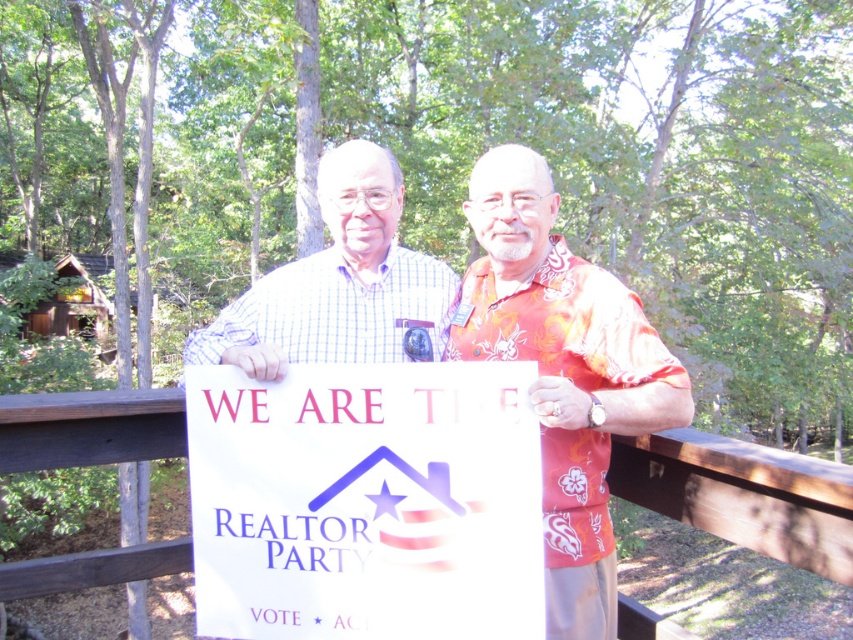
Question: Among these objects, which one is nearest to the camera?

Choices:
 (A) white paper sign at center
 (B) wooden rail at center
 (C) matte white sign at center
 (D) checkered fabric shirt at center

Answer: (B)

Question: Can you confirm if floral print shirt at center is wider than wooden rail at center?

Choices:
 (A) no
 (B) yes

Answer: (B)

Question: Is matte white sign at center positioned behind floral print shirt at center?

Choices:
 (A) yes
 (B) no

Answer: (A)

Question: Among these points, which one is farthest from the camera?

Choices:
 (A) (537, 486)
 (B) (514, 278)
 (C) (329, 358)
 (D) (705, 499)

Answer: (C)

Question: Considering the relative positions of white paper sign at center and checkered fabric shirt at center in the image provided, where is white paper sign at center located with respect to checkered fabric shirt at center?

Choices:
 (A) left
 (B) right

Answer: (B)

Question: Which point appears closest to the camera in this image?

Choices:
 (A) (328, 252)
 (B) (671, 374)
 (C) (349, 141)

Answer: (B)